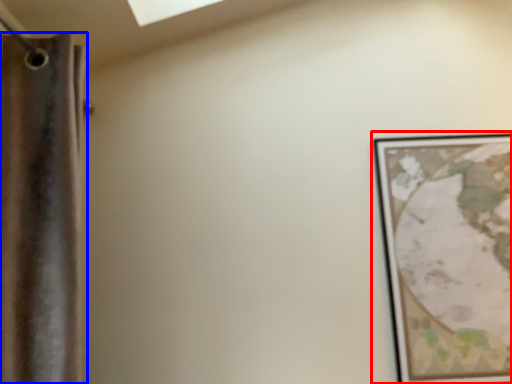
Question: Which of the following is the closest to the observer, picture frame (highlighted by a red box) or curtain (highlighted by a blue box)?

Choices:
 (A) picture frame
 (B) curtain

Answer: (B)